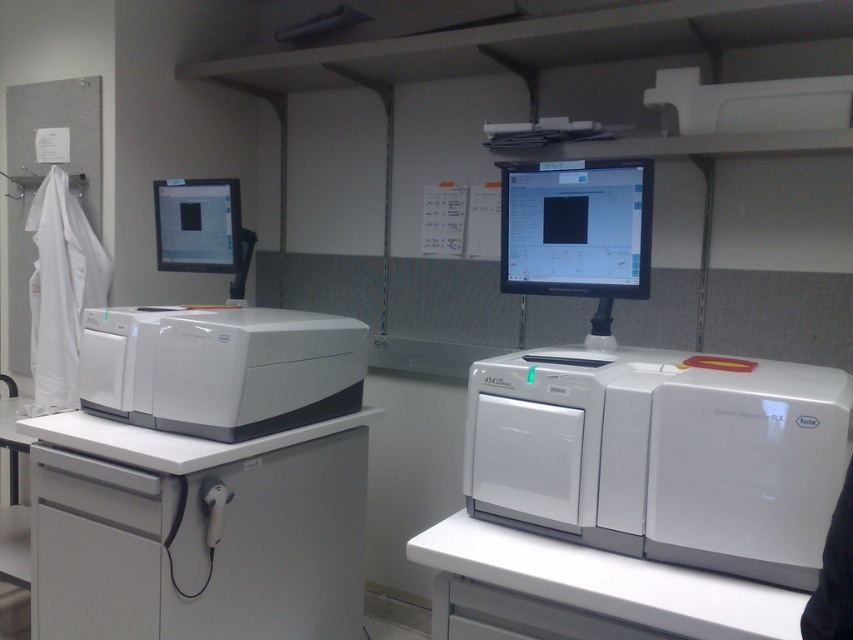
Question: Does white plastic equipment at left have a larger size compared to white plastic printer at left?

Choices:
 (A) yes
 (B) no

Answer: (A)

Question: Considering the relative positions of white plastic printer at right and matte black monitor at center in the image provided, where is white plastic printer at right located with respect to matte black monitor at center?

Choices:
 (A) below
 (B) above

Answer: (A)

Question: Can you confirm if white plastic printer at right is wider than white plastic printer at left?

Choices:
 (A) no
 (B) yes

Answer: (A)

Question: Which object is positioned closest to the white plastic printer at left?

Choices:
 (A) matte black monitor at center
 (B) white plastic printer at right
 (C) matte black monitor at upper left

Answer: (C)

Question: Which point is closer to the camera taking this photo?

Choices:
 (A) (74, 513)
 (B) (502, 284)

Answer: (B)

Question: Which object appears closest to the camera in this image?

Choices:
 (A) matte black monitor at upper left
 (B) matte black monitor at center
 (C) white plastic equipment at left

Answer: (B)